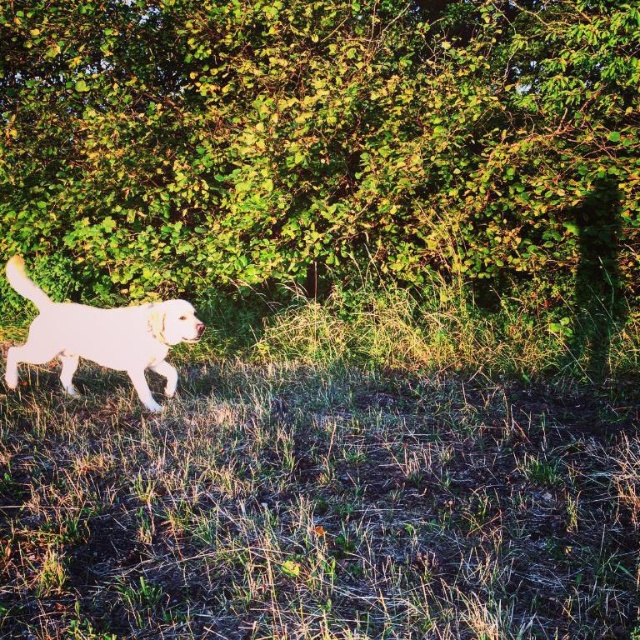
Question: Which point appears closest to the camera in this image?

Choices:
 (A) (545, 240)
 (B) (100, 362)

Answer: (B)

Question: Which point is farther from the camera taking this photo?

Choices:
 (A) (147, 237)
 (B) (193, 323)

Answer: (A)

Question: Is green leafy bush at center positioned behind white fur dog at center?

Choices:
 (A) yes
 (B) no

Answer: (A)

Question: Is green leafy bush at center further to camera compared to white fur dog at center?

Choices:
 (A) no
 (B) yes

Answer: (B)

Question: Is green leafy bush at center below white fur dog at center?

Choices:
 (A) no
 (B) yes

Answer: (A)